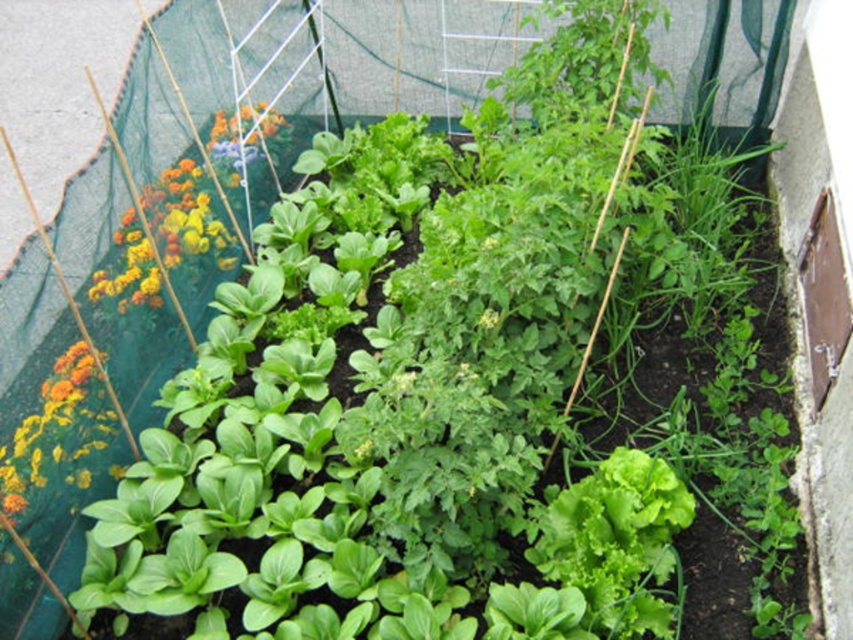
How distant is green leafy lettuce at center from vibrant multicolored flowers at left?

green leafy lettuce at center is 4.54 feet away from vibrant multicolored flowers at left.

How far apart are green leafy lettuce at center and vibrant multicolored flowers at left?

They are 1.39 meters apart.

Is point (637, 572) closer to camera compared to point (170, 205)?

That is True.

The image size is (853, 640). I want to click on green leafy lettuce at center, so point(614,541).